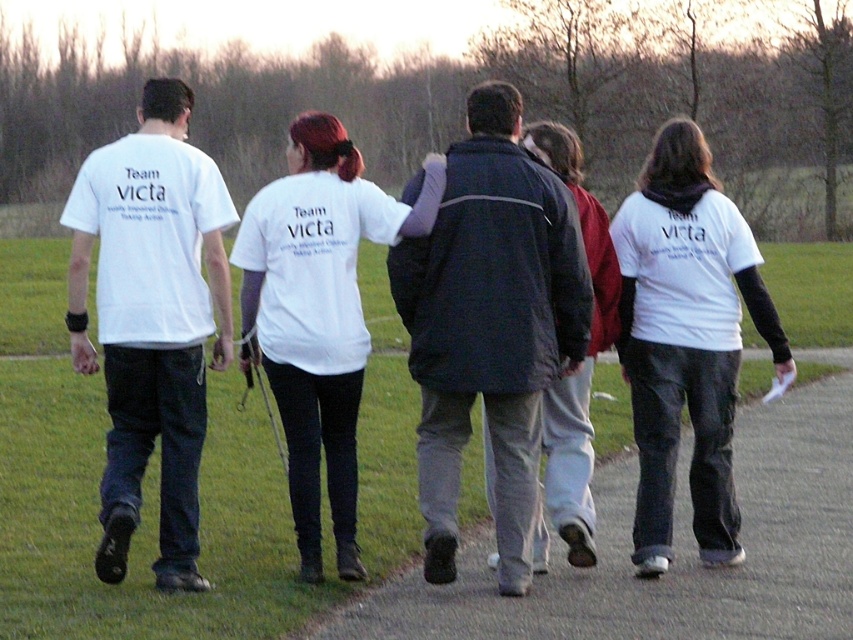
Question: Among these objects, which one is farthest from the camera?

Choices:
 (A) smooth concrete pavement at center
 (B) dark blue jacket at center
 (C) dark gray jacket at center
 (D) white matte t-shirt at right

Answer: (A)

Question: Observing the image, what is the correct spatial positioning of smooth concrete pavement at center in reference to dark blue jacket at center?

Choices:
 (A) below
 (B) above

Answer: (A)

Question: Can you confirm if smooth concrete pavement at center is positioned below white matte t-shirt at right?

Choices:
 (A) no
 (B) yes

Answer: (B)

Question: Is the position of white matte t-shirt at left less distant than that of white matte t-shirt at center?

Choices:
 (A) yes
 (B) no

Answer: (A)

Question: Which object is farther from the camera taking this photo?

Choices:
 (A) white matte t-shirt at center
 (B) smooth concrete pavement at center

Answer: (B)

Question: Which point is farther to the camera?

Choices:
 (A) (624, 538)
 (B) (437, 240)
 (C) (184, 200)
 (D) (311, 433)

Answer: (A)